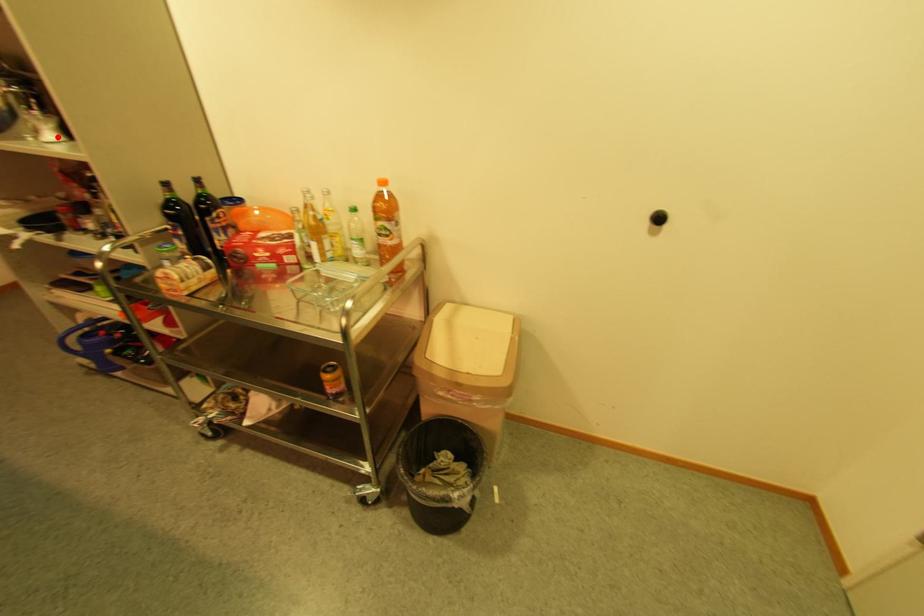
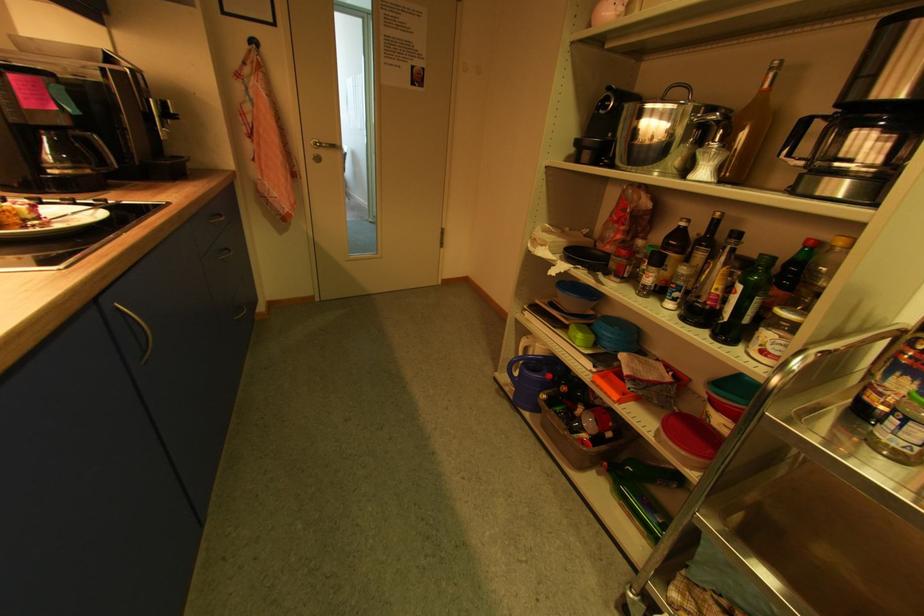
Question: I am providing you with two images of the same scene from different viewpoints. Given a red point in image1, look at the same physical point in image2. Is it:

Choices:
 (A) Closer to the viewpoint
 (B) Farther from the viewpoint

Answer: (A)